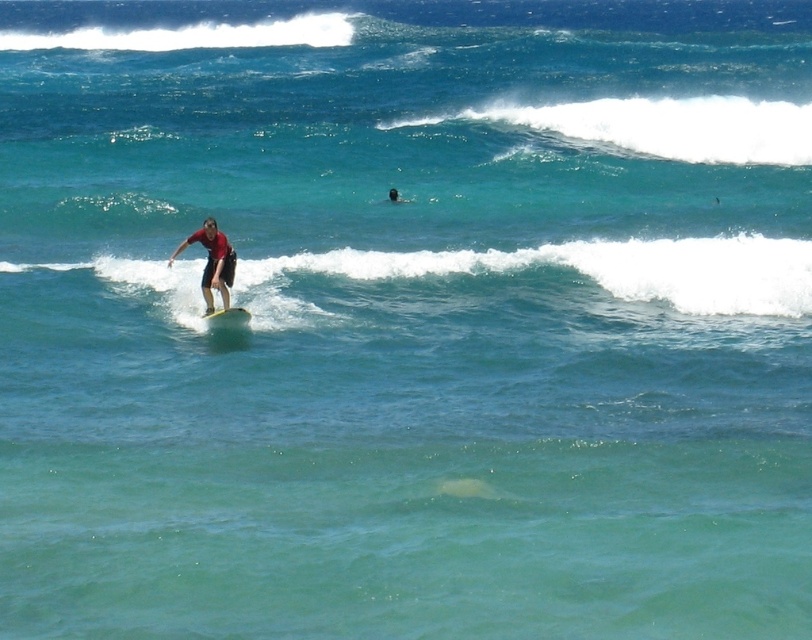
You are a photographer trying to capture the surfer in the ocean. You need to ensure that both the matte red shirt at center and the white foam surfboard at center are in focus. Given that your camera has a depth of field that can cover objects within a 15 inches range, will both objects be in focus?

The matte red shirt at center is 15.38 inches away from the white foam surfboard at center. Since the distance between them exceeds the camera sensor depth of field range of 15 inches, the objects might not both be in focus simultaneously.

You are a photographer capturing the surfer in the ocean. You notice the matte red shirt at center and the white foam surfboard at center. Which object is wider from your viewpoint?

The matte red shirt at center might be wider than white foam surfboard at center according to the description.

You are a photographer on a boat observing the scene. You want to capture a photo where the white foamy wave at center is positioned above the matte red shirt at center. Is this possible based on the current arrangement?

Yes, the white foamy wave at center is already located above the matte red shirt at center in the current arrangement, so this photo is achievable.